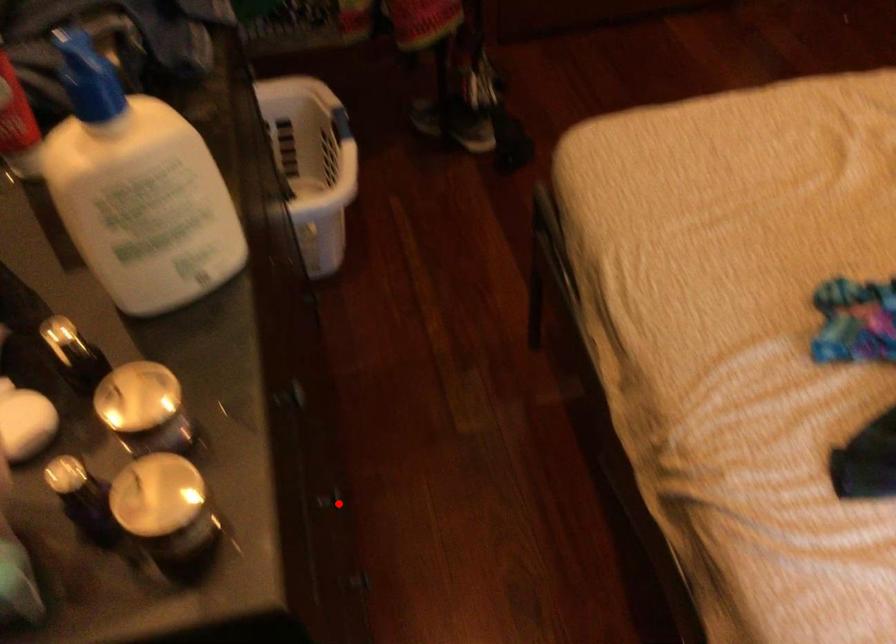
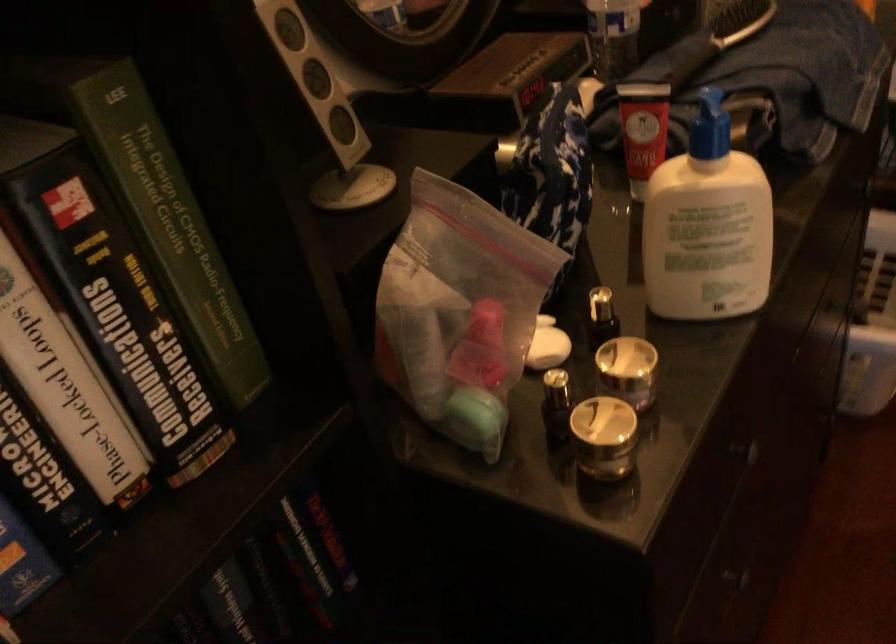
In the second image, find the point that corresponds to the highlighted location in the first image.

(738, 581)